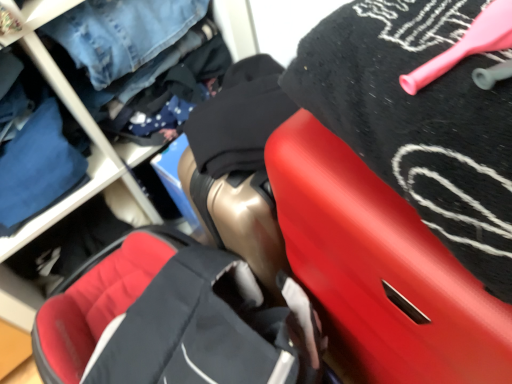
Question: From the image's perspective, is soft fabric baby carriage at center positioned above or below blue denim jeans at upper left, which ranks as the 1th clothing in back-to-front order?

Choices:
 (A) above
 (B) below

Answer: (B)

Question: Is soft fabric baby carriage at center in front of or behind blue denim jeans at upper left, which is the 2th clothing from right to left, in the image?

Choices:
 (A) behind
 (B) front

Answer: (B)

Question: Which object is positioned farthest from the blue denim jeans at upper left, which ranks as the 1th clothing in back-to-front order?

Choices:
 (A) soft fabric baby carriage at center
 (B) black matte towel at upper right, the second clothing when ordered from back to front
 (C) rubberized red suitcase at upper right

Answer: (B)

Question: Which of these objects is positioned closest to the black matte towel at upper right, which is the first clothing from right to left?

Choices:
 (A) soft fabric baby carriage at center
 (B) rubberized red suitcase at upper right
 (C) blue denim jeans at upper left, the second clothing in the front-to-back sequence

Answer: (B)